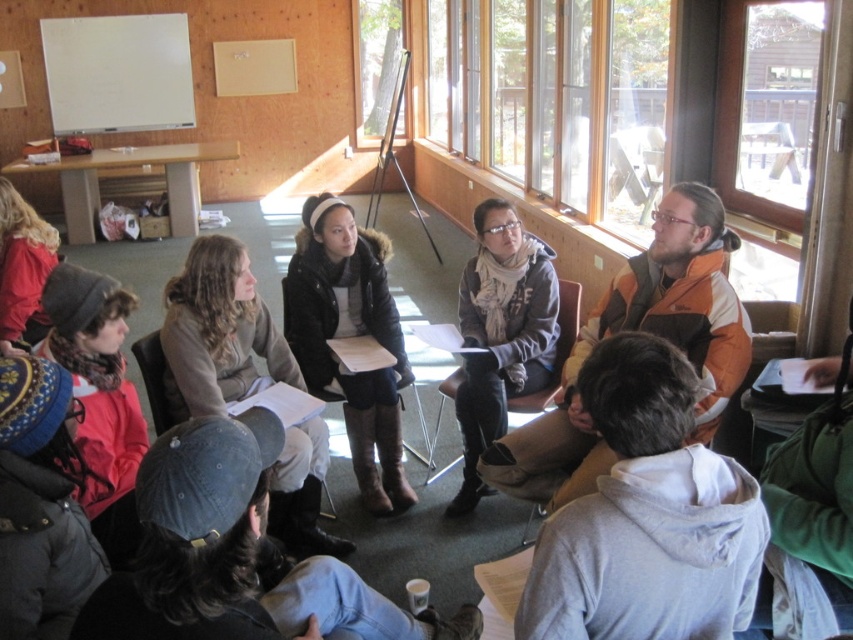
You are a delivery robot with a package that needs to be placed between the orange and brown jacket at upper right and the brown leather jacket at center. The package is 1 meter long. Can you fit the package between them?

The distance between the orange and brown jacket at upper right and the brown leather jacket at center is 1.01 meters, so yes, the package can fit as it is slightly longer than the package.

You are a photographer trying to capture a candid shot of the group. You notice the brown leather jacket at center and the gray wool scarf at center are partially blocking each other. Which item should you adjust to ensure both are visible in the photo?

The brown leather jacket at center is in front of the gray wool scarf at center. To ensure both are visible, you should adjust the brown leather jacket at center so it is moved back or repositioned to allow the gray wool scarf at center to be seen.